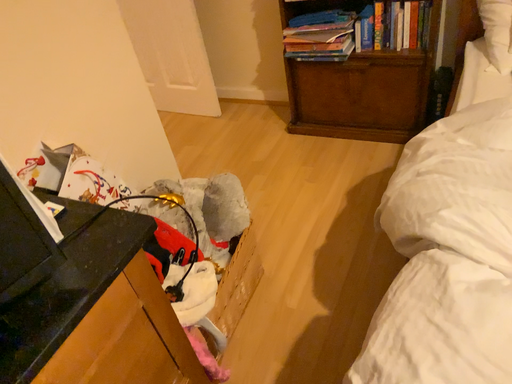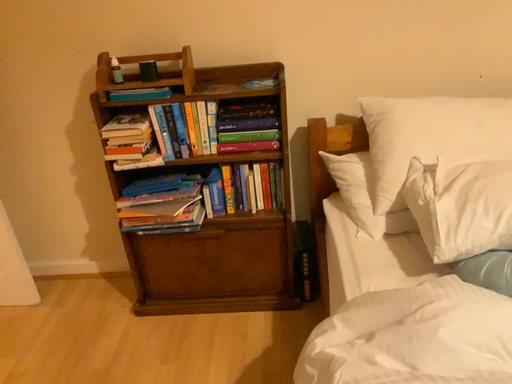
Question: How did the camera likely rotate when shooting the video?

Choices:
 (A) rotated upward
 (B) rotated downward

Answer: (A)